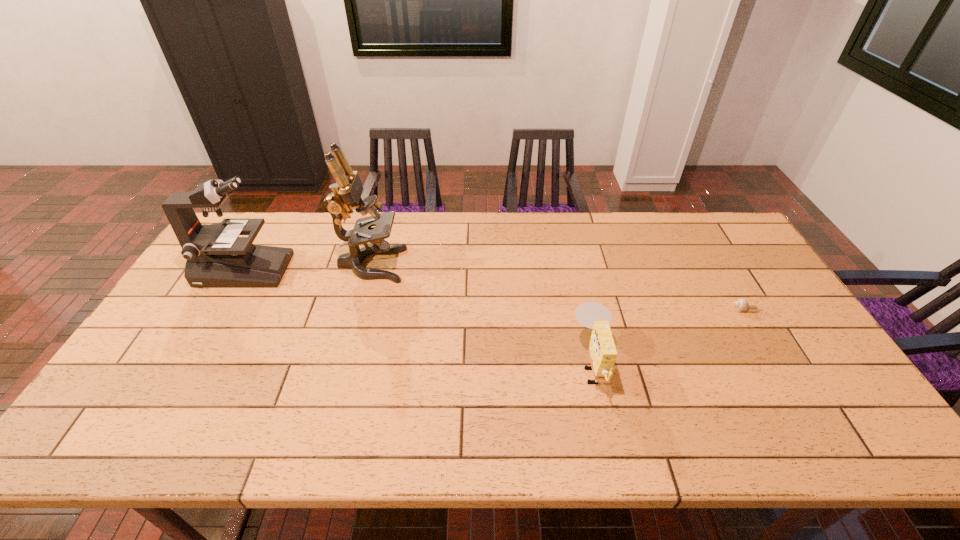
This screenshot has width=960, height=540. In order to click on vacant region between the tallest object and the third farthest object in this screenshot , I will do `click(558, 287)`.

Find the location of a particular element. This screenshot has height=540, width=960. empty space that is in between the escargot and the second tallest object is located at coordinates (494, 290).

This screenshot has height=540, width=960. Find the location of `empty location between the escargot and the second object from left to right`. empty location between the escargot and the second object from left to right is located at coordinates (558, 287).

At what (x,y) coordinates should I click in order to perform the action: click on vacant space in between the tallest object and the third tallest object. Please return your answer as a coordinate pair (x, y). This screenshot has height=540, width=960. Looking at the image, I should click on (482, 314).

This screenshot has width=960, height=540. I want to click on vacant space that's between the shortest object and the nearest object, so click(x=668, y=337).

Locate an element on the screen. This screenshot has width=960, height=540. object that stands as the third closest to the taller microscope is located at coordinates (741, 305).

Locate an element on the screen. This screenshot has width=960, height=540. the third closest object relative to the leftmost object is located at coordinates (741, 305).